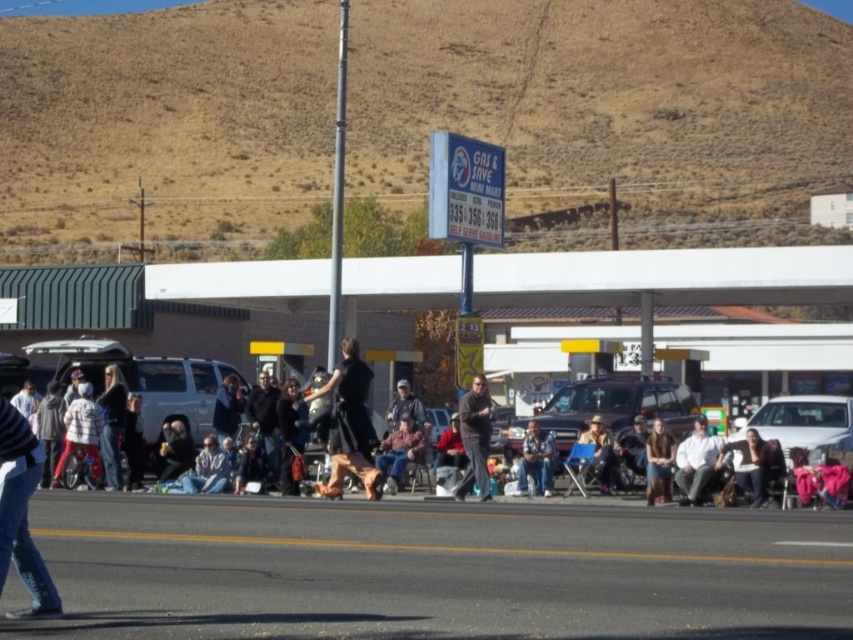
Between black fabric crowd at center and dark gray sweater at center, which one is positioned lower?

Positioned lower is dark gray sweater at center.

Looking at this image, is black fabric crowd at center closer to camera compared to dark gray sweater at center?

That is False.

Which is behind, point (167, 410) or point (471, 451)?

The point (167, 410) is behind.

Find the location of a particular element. black fabric crowd at center is located at coordinates (143, 380).

Is black fabric crowd at center wider than dark gray fabric jacket at center?

Indeed, black fabric crowd at center has a greater width compared to dark gray fabric jacket at center.

Who is shorter, black fabric crowd at center or dark gray fabric jacket at center?

dark gray fabric jacket at center

Who is more distant from viewer, (x=201, y=400) or (x=259, y=388)?

Point (x=201, y=400)

Image resolution: width=853 pixels, height=640 pixels. I want to click on black fabric crowd at center, so click(143, 380).

Between dark gray sweater at center and dark gray fabric jacket at center, which one is positioned lower?

dark gray sweater at center is below.

Is point (479, 376) positioned before point (260, 371)?

Yes, it is.

Find the location of a particular element. This screenshot has height=640, width=853. dark gray sweater at center is located at coordinates (474, 436).